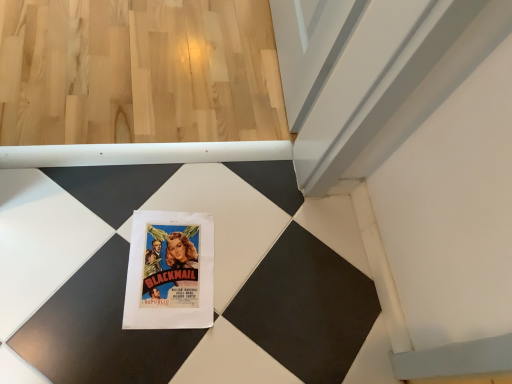
Find the location of a particular element. The width and height of the screenshot is (512, 384). matte paper poster at center is located at coordinates (170, 271).

This screenshot has height=384, width=512. What do you see at coordinates (170, 271) in the screenshot?
I see `matte paper poster at center` at bounding box center [170, 271].

Locate an element on the screen. The image size is (512, 384). matte paper poster at center is located at coordinates (170, 271).